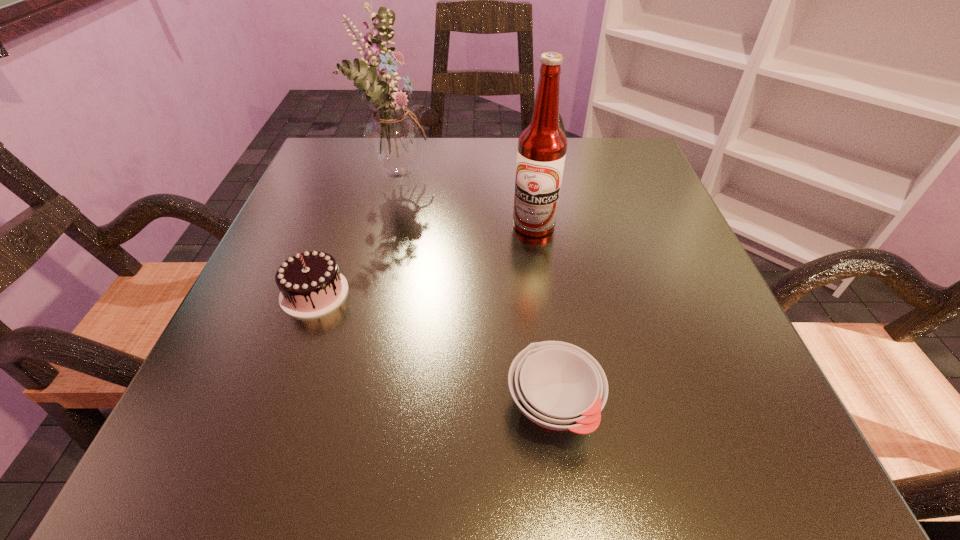
Find the location of a particular element. vacant point located between the nearest object and the second nearest object is located at coordinates 434,349.

At what (x,y) coordinates should I click in order to perform the action: click on free point between the chocolate cake and the farthest object. Please return your answer as a coordinate pair (x, y). Looking at the image, I should click on (357, 232).

Locate an element on the screen. The image size is (960, 540). vacant area that lies between the second shortest object and the alcohol is located at coordinates (424, 259).

Where is `the third closest object to the soup bowl`? the third closest object to the soup bowl is located at coordinates (393, 138).

This screenshot has height=540, width=960. Identify the location of the closest object relative to the third nearest object. (393, 138).

At what (x,y) coordinates should I click in order to perform the action: click on free space in the image that satisfies the following two spatial constraints: 1. on the front-facing side of the farthest object; 2. on the front side of the chocolate cake. Please return your answer as a coordinate pair (x, y). Image resolution: width=960 pixels, height=540 pixels. Looking at the image, I should click on (372, 293).

Identify the location of free space that satisfies the following two spatial constraints: 1. on the front-facing side of the nearest object; 2. on the right side of the bouquet. The width and height of the screenshot is (960, 540). (345, 405).